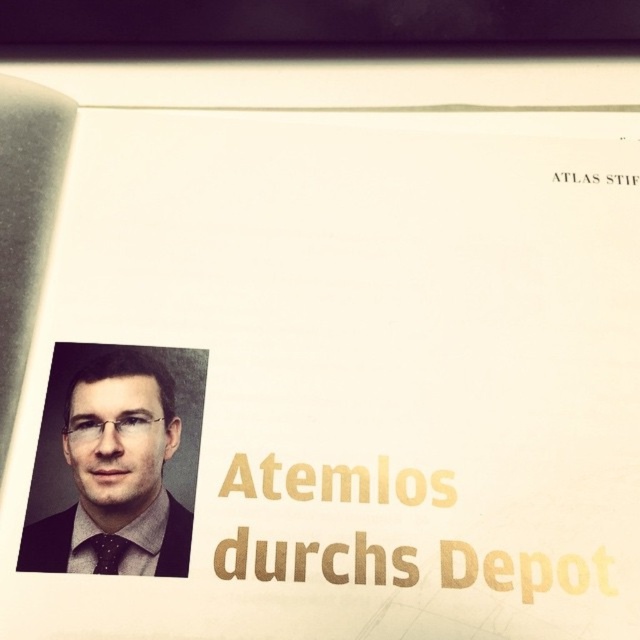
Who is more forward, (84, 468) or (97, 563)?

Point (97, 563)

This screenshot has height=640, width=640. I want to click on matte black suit at left, so click(x=116, y=472).

This screenshot has width=640, height=640. What are the coordinates of `matte black suit at left` in the screenshot? It's located at (116, 472).